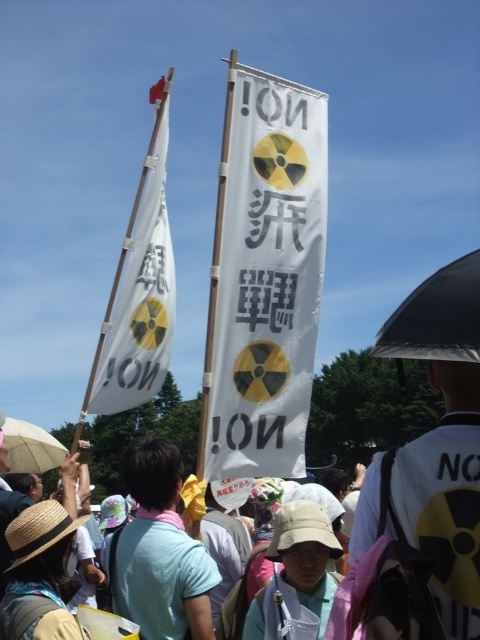
Question: Observing the image, what is the correct spatial positioning of light blue cotton shirt at center in reference to beige fabric umbrella at lower left?

Choices:
 (A) above
 (B) below

Answer: (B)

Question: Which object is farther from the camera taking this photo?

Choices:
 (A) white paper flag at upper left
 (B) beige fabric umbrella at lower left
 (C) light blue cotton shirt at center
 (D) white paper banner at center

Answer: (B)

Question: Which of the following is the closest to the observer?

Choices:
 (A) beige fabric umbrella at lower left
 (B) light blue cotton shirt at center

Answer: (B)

Question: Can you confirm if white paper banner at center is smaller than beige fabric umbrella at lower left?

Choices:
 (A) yes
 (B) no

Answer: (B)

Question: Which point is closer to the camera taking this photo?

Choices:
 (A) (24, 422)
 (B) (208, 472)
 (C) (192, 609)

Answer: (C)

Question: Is white paper banner at center further to the viewer compared to light blue cotton shirt at center?

Choices:
 (A) no
 (B) yes

Answer: (B)